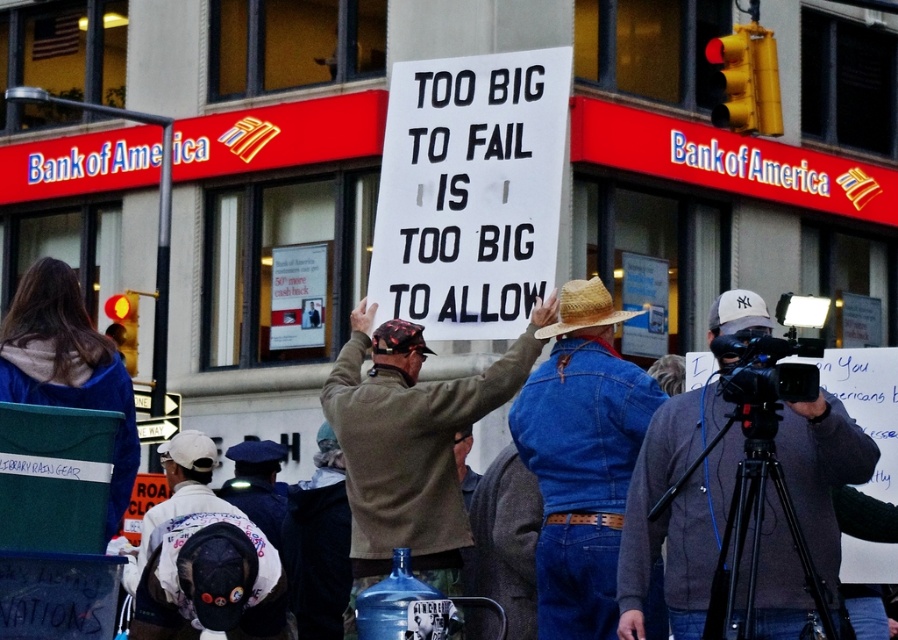
Who is positioned more to the left, khaki cotton jacket at center or strawhat at center?

From the viewer's perspective, khaki cotton jacket at center appears more on the left side.

Looking at this image, measure the distance between khaki cotton jacket at center and camera.

The distance of khaki cotton jacket at center from camera is 45.78 meters.

What are the coordinates of `khaki cotton jacket at center` in the screenshot? It's located at (411, 440).

Which is more to the left, gray fabric jacket at center or strawhat at center?

strawhat at center is more to the left.

Who is more forward, (707, 506) or (591, 321)?

Point (707, 506) is in front.

This screenshot has height=640, width=898. What do you see at coordinates (676, 509) in the screenshot? I see `gray fabric jacket at center` at bounding box center [676, 509].

Find the location of a particular element. The height and width of the screenshot is (640, 898). gray fabric jacket at center is located at coordinates (676, 509).

Which of these two, denim jacket at center or khaki cotton jacket at center, stands shorter?

khaki cotton jacket at center is shorter.

Is denim jacket at center to the left of khaki cotton jacket at center from the viewer's perspective?

Incorrect, denim jacket at center is not on the left side of khaki cotton jacket at center.

This screenshot has width=898, height=640. What are the coordinates of `denim jacket at center` in the screenshot? It's located at (580, 458).